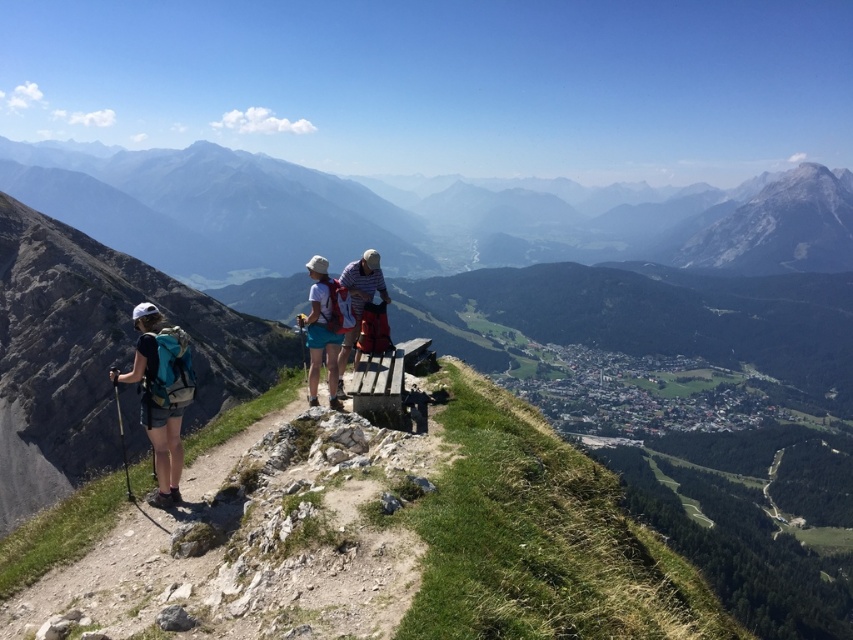
Does rocky mountain at center have a greater height compared to striped cotton shirt at center?

Indeed, rocky mountain at center has a greater height compared to striped cotton shirt at center.

Who is taller, rocky mountain at center or striped cotton shirt at center?

With more height is rocky mountain at center.

Does point (645, 186) lie behind point (357, 276)?

That is True.

Identify the location of rocky mountain at center. The image size is (853, 640). (416, 216).

Can you confirm if matte teal backpack at left is taller than striped cotton shirt at center?

Indeed, matte teal backpack at left has a greater height compared to striped cotton shirt at center.

Which of these two, matte teal backpack at left or striped cotton shirt at center, stands shorter?

With less height is striped cotton shirt at center.

Does point (148, 378) lie in front of point (381, 276)?

Yes, it is in front of point (381, 276).

Image resolution: width=853 pixels, height=640 pixels. Find the location of `matte teal backpack at left`. matte teal backpack at left is located at coordinates (160, 394).

Does rocky mountain at center appear over matte teal backpack at left?

Indeed, rocky mountain at center is positioned over matte teal backpack at left.

Looking at this image, how distant is rocky mountain at center from matte teal backpack at left?

A distance of 1795.77 feet exists between rocky mountain at center and matte teal backpack at left.

Measure the distance between point (727,253) and camera.

Point (727,253) is 1692.72 feet away from camera.

Where is `rocky mountain at center`? The width and height of the screenshot is (853, 640). rocky mountain at center is located at coordinates (416, 216).